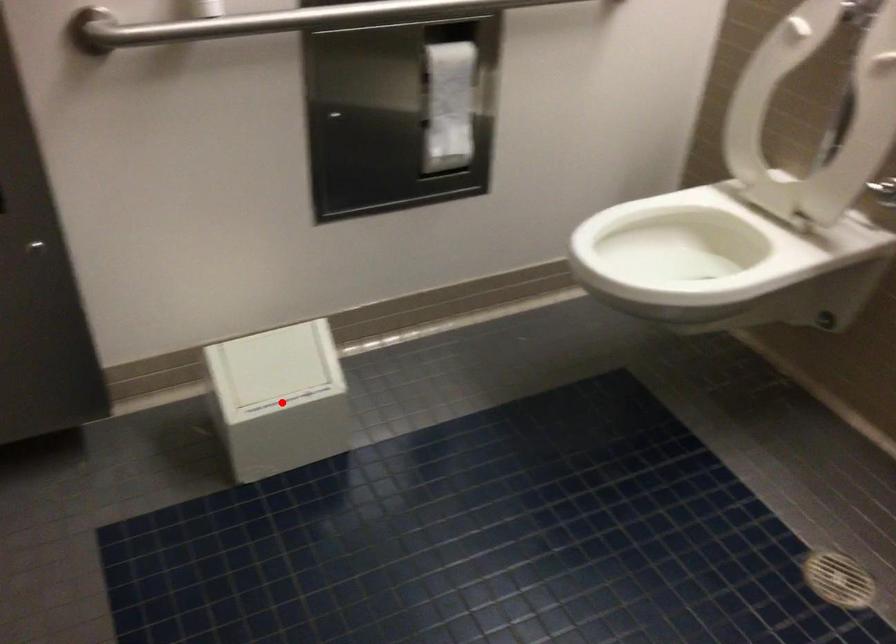
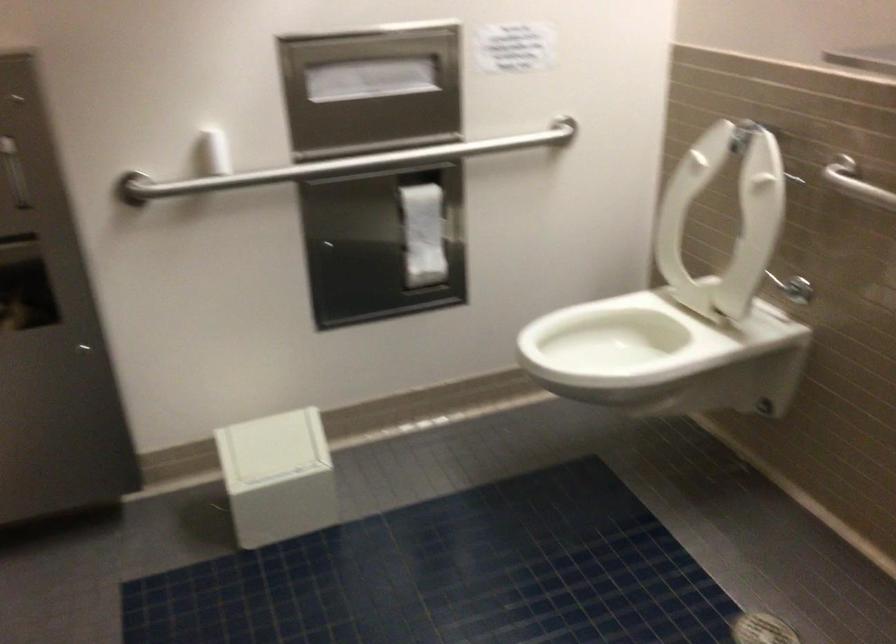
Question: I am providing you with two images of the same scene from different viewpoints. Image1 has a red point marked. In image2, the corresponding 3D location appears at what relative position? Reply with the corresponding letter.

Choices:
 (A) Closer
 (B) Farther

Answer: (B)